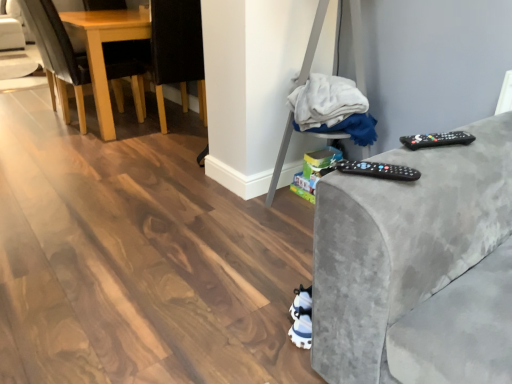
Question: From a real-world perspective, is black fabric chair at left, which is counted as the 2th chair, starting from the left, under black plastic remote at right, acting as the 1th remote starting from the right?

Choices:
 (A) no
 (B) yes

Answer: (B)

Question: Can you confirm if black fabric chair at left, which is the 1th chair in right-to-left order, is taller than black plastic remote at right, which appears as the 1th remote when viewed from the top?

Choices:
 (A) yes
 (B) no

Answer: (A)

Question: From a real-world perspective, is black fabric chair at left, which is the 1th chair in right-to-left order, located higher than black plastic remote at right, which appears as the 1th remote when viewed from the top?

Choices:
 (A) no
 (B) yes

Answer: (A)

Question: Can you confirm if black fabric chair at left, which is the 1th chair in right-to-left order, is positioned to the left of black plastic remote at right, acting as the 1th remote starting from the right?

Choices:
 (A) no
 (B) yes

Answer: (B)

Question: Is black plastic remote at right, which appears as the 1th remote when viewed from the top, inside black fabric chair at left, which is counted as the 2th chair, starting from the left?

Choices:
 (A) yes
 (B) no

Answer: (B)

Question: Based on their sizes in the image, would you say light brown wood chair at left, the 1th chair when ordered from left to right, is bigger or smaller than black fabric chair at left, which is the 1th chair in right-to-left order?

Choices:
 (A) big
 (B) small

Answer: (A)

Question: Does point (41, 13) appear closer or farther from the camera than point (150, 43)?

Choices:
 (A) farther
 (B) closer

Answer: (B)

Question: In the image, is light brown wood chair at left, the 1th chair when ordered from left to right, positioned in front of or behind black fabric chair at left, which is counted as the 2th chair, starting from the left?

Choices:
 (A) behind
 (B) front

Answer: (B)

Question: Based on their positions, is light brown wood chair at left, the 1th chair when ordered from left to right, located to the left or right of black fabric chair at left, which is the 1th chair in right-to-left order?

Choices:
 (A) left
 (B) right

Answer: (A)

Question: Considering the positions of black fabric chair at left, which is counted as the 2th chair, starting from the left, and black plastic remote at right, the second remote in the left-to-right sequence, in the image, is black fabric chair at left, which is counted as the 2th chair, starting from the left, bigger or smaller than black plastic remote at right, the second remote in the left-to-right sequence,?

Choices:
 (A) small
 (B) big

Answer: (B)

Question: Relative to black plastic remote at right, arranged as the second remote when ordered from the bottom, is black fabric chair at left, which is the 1th chair in right-to-left order, in front or behind?

Choices:
 (A) behind
 (B) front

Answer: (A)

Question: Choose the correct answer: Is black fabric chair at left, which is counted as the 2th chair, starting from the left, inside black plastic remote at right, which appears as the 1th remote when viewed from the top, or outside it?

Choices:
 (A) inside
 (B) outside

Answer: (B)

Question: From the image's perspective, is black fabric chair at left, which is counted as the 2th chair, starting from the left, positioned above or below black plastic remote at right, the second remote in the left-to-right sequence?

Choices:
 (A) above
 (B) below

Answer: (A)

Question: Considering the positions of black plastic remote at right, which is the first remote from back to front, and white fabric at center in the image, is black plastic remote at right, which is the first remote from back to front, taller or shorter than white fabric at center?

Choices:
 (A) short
 (B) tall

Answer: (A)

Question: Is point (463, 144) positioned closer to the camera than point (342, 105)?

Choices:
 (A) farther
 (B) closer

Answer: (B)